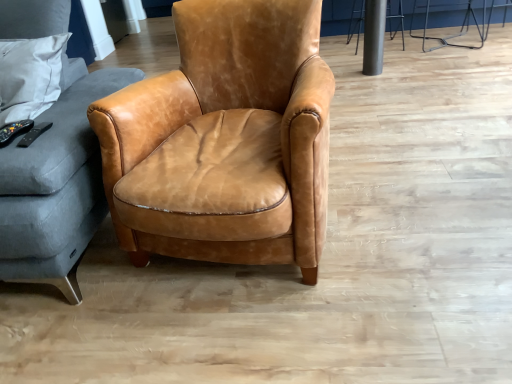
What is the approximate height of matte gray fabric studio couch at left?

matte gray fabric studio couch at left is 90.58 centimeters tall.

What do you see at coordinates (451, 35) in the screenshot?
I see `metallic silver bar stool at upper right, which is counted as the first bar stool, starting from the right` at bounding box center [451, 35].

In order to face metallic silver bar stool at upper right, the first bar stool when ordered from left to right, should I rotate leftwards or rightwards?

You should rotate right by 15.599 degrees.

Locate an element on the screen. The height and width of the screenshot is (384, 512). matte gray fabric studio couch at left is located at coordinates (56, 185).

In terms of size, does metallic silver bar stool at upper right, which is counted as the 2th bar stool, starting from the left, appear bigger or smaller than matte gray fabric studio couch at left?

Considering their sizes, metallic silver bar stool at upper right, which is counted as the 2th bar stool, starting from the left, takes up less space than matte gray fabric studio couch at left.

Is metallic silver bar stool at upper right, which is counted as the 2th bar stool, starting from the left, positioned far away from matte gray fabric studio couch at left?

Yes, metallic silver bar stool at upper right, which is counted as the 2th bar stool, starting from the left, and matte gray fabric studio couch at left are quite far apart.

Does point (416, 0) appear closer or farther from the camera than point (17, 207)?

Point (416, 0) is farther from the camera than point (17, 207).

Is point (415, 2) positioned before point (302, 122)?

No, it is not.

Looking at this image, based on their positions, is metallic silver bar stool at upper right, which is counted as the 2th bar stool, starting from the left, located to the left or right of cognac leather armchair at center?

metallic silver bar stool at upper right, which is counted as the 2th bar stool, starting from the left, is positioned on cognac leather armchair at center's right side.

Can you confirm if matte gray fabric studio couch at left is taller than metallic silver bar stool at upper right, acting as the 2th bar stool starting from the right?

Correct, matte gray fabric studio couch at left is much taller as metallic silver bar stool at upper right, acting as the 2th bar stool starting from the right.

Is matte gray fabric studio couch at left inside or outside of metallic silver bar stool at upper right, the first bar stool when ordered from left to right?

matte gray fabric studio couch at left exists outside the volume of metallic silver bar stool at upper right, the first bar stool when ordered from left to right.

I want to click on bar stool that is the 2nd object located above the matte gray fabric studio couch at left (from the image's perspective), so click(x=356, y=21).

How many degrees apart are the facing directions of matte gray fabric studio couch at left and metallic silver bar stool at upper right, the first bar stool when ordered from left to right?

matte gray fabric studio couch at left and metallic silver bar stool at upper right, the first bar stool when ordered from left to right, are facing 178 degrees away from each other.

Looking at this image, between metallic silver bar stool at upper right, the first bar stool when ordered from left to right, and matte gray fabric studio couch at left, which one has less height?

metallic silver bar stool at upper right, the first bar stool when ordered from left to right.

Is point (357, 17) positioned in front of point (3, 247)?

That is False.

From a real-world perspective, is metallic silver bar stool at upper right, the first bar stool when ordered from left to right, on matte gray fabric studio couch at left?

No, from a real-world perspective, metallic silver bar stool at upper right, the first bar stool when ordered from left to right, is not on top of matte gray fabric studio couch at left.

Considering the sizes of objects matte gray fabric studio couch at left and cognac leather armchair at center in the image provided, who is wider, matte gray fabric studio couch at left or cognac leather armchair at center?

Wider between the two is matte gray fabric studio couch at left.

Considering the relative sizes of matte gray fabric studio couch at left and cognac leather armchair at center in the image provided, is matte gray fabric studio couch at left taller than cognac leather armchair at center?

Yes.

Is matte gray fabric studio couch at left to the left of cognac leather armchair at center from the viewer's perspective?

Indeed, matte gray fabric studio couch at left is positioned on the left side of cognac leather armchair at center.

Is matte gray fabric studio couch at left smaller than cognac leather armchair at center?

Incorrect, matte gray fabric studio couch at left is not smaller in size than cognac leather armchair at center.

Which of these two, cognac leather armchair at center or metallic silver bar stool at upper right, the first bar stool when ordered from left to right, stands taller?

cognac leather armchair at center.

Is cognac leather armchair at center aimed at metallic silver bar stool at upper right, the first bar stool when ordered from left to right?

No, cognac leather armchair at center is not facing towards metallic silver bar stool at upper right, the first bar stool when ordered from left to right.

Can you confirm if cognac leather armchair at center is wider than metallic silver bar stool at upper right, the first bar stool when ordered from left to right?

Correct, the width of cognac leather armchair at center exceeds that of metallic silver bar stool at upper right, the first bar stool when ordered from left to right.

Consider the image. Considering the positions of objects cognac leather armchair at center and metallic silver bar stool at upper right, acting as the 2th bar stool starting from the right, in the image provided, who is behind, cognac leather armchair at center or metallic silver bar stool at upper right, acting as the 2th bar stool starting from the right,?

metallic silver bar stool at upper right, acting as the 2th bar stool starting from the right, is more distant.

Who is more distant, cognac leather armchair at center or matte gray fabric studio couch at left?

matte gray fabric studio couch at left.

Is point (200, 54) in front of point (57, 126)?

No.

Are cognac leather armchair at center and matte gray fabric studio couch at left making contact?

No, cognac leather armchair at center is not in contact with matte gray fabric studio couch at left.

Where is `bar stool that is the 1st object located above the matte gray fabric studio couch at left (from the image's perspective)`? The image size is (512, 384). bar stool that is the 1st object located above the matte gray fabric studio couch at left (from the image's perspective) is located at coordinates (451, 35).

The image size is (512, 384). I want to click on chair above the metallic silver bar stool at upper right, which is counted as the first bar stool, starting from the right (from a real-world perspective), so click(x=229, y=113).

When comparing their distances from cognac leather armchair at center, does matte gray fabric studio couch at left or metallic silver bar stool at upper right, the first bar stool when ordered from left to right, seem closer?

matte gray fabric studio couch at left lies closer to cognac leather armchair at center than the other object.

Consider the image. When comparing their distances from matte gray fabric studio couch at left, does metallic silver bar stool at upper right, which is counted as the 2th bar stool, starting from the left, or metallic silver bar stool at upper right, the first bar stool when ordered from left to right, seem further?

metallic silver bar stool at upper right, the first bar stool when ordered from left to right.

Looking at the image, which one is located closer to matte gray fabric studio couch at left, metallic silver bar stool at upper right, the first bar stool when ordered from left to right, or cognac leather armchair at center?

cognac leather armchair at center lies closer to matte gray fabric studio couch at left than the other object.

Which object lies further to the anchor point cognac leather armchair at center, metallic silver bar stool at upper right, the first bar stool when ordered from left to right, or matte gray fabric studio couch at left?

Based on the image, metallic silver bar stool at upper right, the first bar stool when ordered from left to right, appears to be further to cognac leather armchair at center.

When comparing their distances from metallic silver bar stool at upper right, acting as the 2th bar stool starting from the right, does cognac leather armchair at center or metallic silver bar stool at upper right, which is counted as the 2th bar stool, starting from the left, seem closer?

Based on the image, metallic silver bar stool at upper right, which is counted as the 2th bar stool, starting from the left, appears to be nearer to metallic silver bar stool at upper right, acting as the 2th bar stool starting from the right.

Looking at the image, which one is located closer to cognac leather armchair at center, metallic silver bar stool at upper right, which is counted as the first bar stool, starting from the right, or metallic silver bar stool at upper right, the first bar stool when ordered from left to right?

Based on the image, metallic silver bar stool at upper right, which is counted as the first bar stool, starting from the right, appears to be nearer to cognac leather armchair at center.

Based on their spatial positions, is cognac leather armchair at center or metallic silver bar stool at upper right, the first bar stool when ordered from left to right, closer to metallic silver bar stool at upper right, which is counted as the first bar stool, starting from the right?

The object closer to metallic silver bar stool at upper right, which is counted as the first bar stool, starting from the right, is metallic silver bar stool at upper right, the first bar stool when ordered from left to right.

Looking at the image, which one is located closer to metallic silver bar stool at upper right, which is counted as the 2th bar stool, starting from the left, cognac leather armchair at center or matte gray fabric studio couch at left?

The object closer to metallic silver bar stool at upper right, which is counted as the 2th bar stool, starting from the left, is cognac leather armchair at center.

Identify the location of chair between matte gray fabric studio couch at left and metallic silver bar stool at upper right, which is counted as the first bar stool, starting from the right, from left to right. This screenshot has height=384, width=512. (229, 113).

Find the location of a particular element. Image resolution: width=512 pixels, height=384 pixels. bar stool between matte gray fabric studio couch at left and metallic silver bar stool at upper right, which is counted as the 2th bar stool, starting from the left is located at coordinates (356, 21).

Identify the location of bar stool positioned between cognac leather armchair at center and metallic silver bar stool at upper right, the first bar stool when ordered from left to right, from near to far. (451, 35).

The image size is (512, 384). I want to click on studio couch located between cognac leather armchair at center and metallic silver bar stool at upper right, the first bar stool when ordered from left to right, in the depth direction, so click(56, 185).